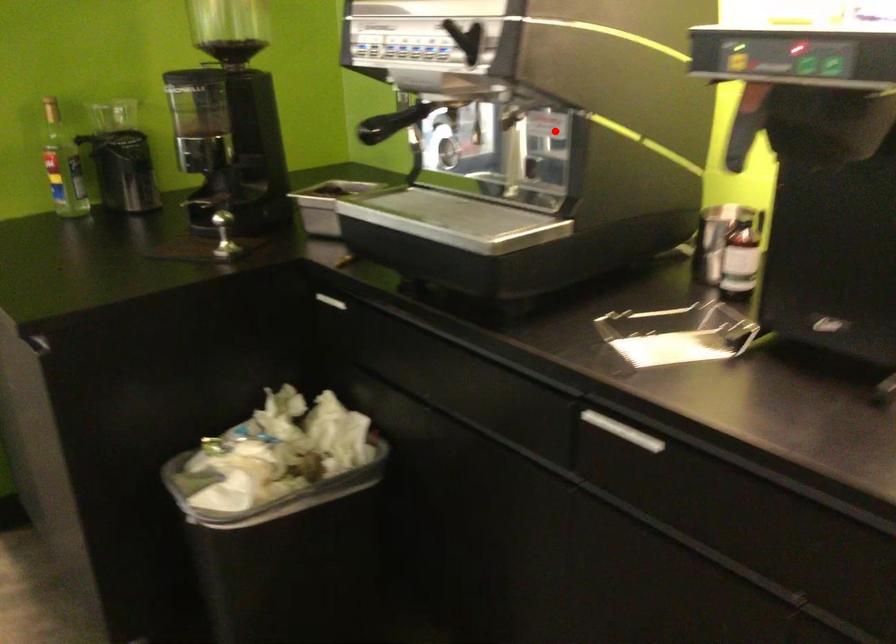
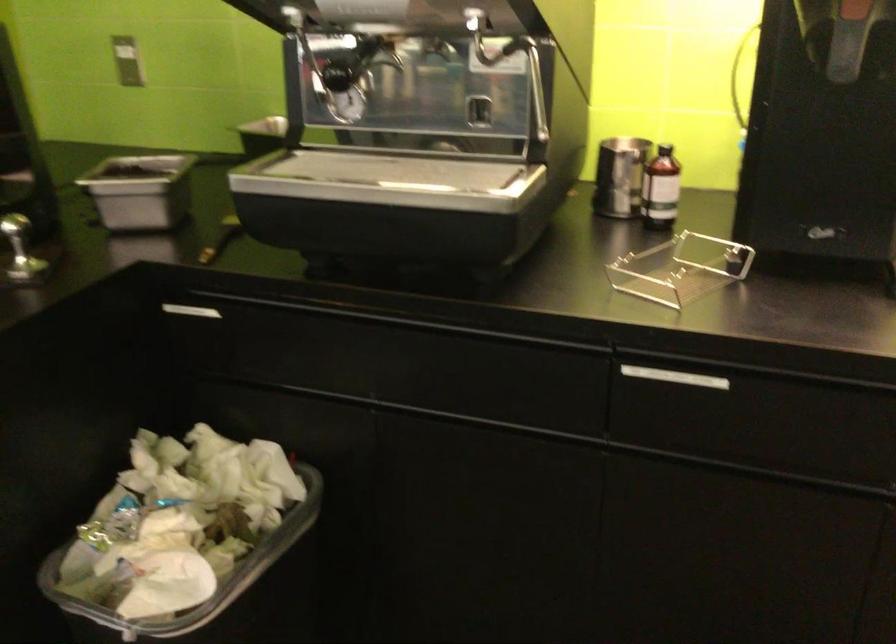
Question: I am providing you with two images of the same scene from different viewpoints. A red point is shown in image1. For the corresponding object point in image2, is it positioned nearer or farther from the camera?

Choices:
 (A) Nearer
 (B) Farther

Answer: (A)